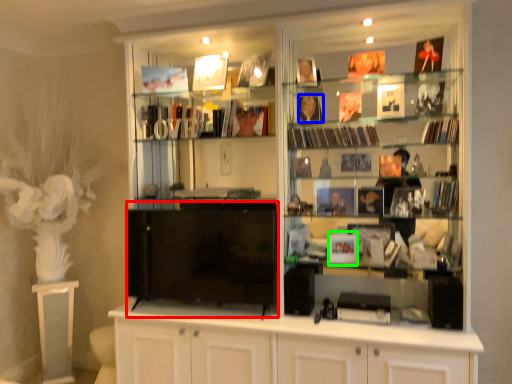
Question: Estimate the real-world distances between objects in this image. Which object is closer to wide (highlighted by a red box), book (highlighted by a blue box) or book (highlighted by a green box)?

Choices:
 (A) book
 (B) book

Answer: (B)